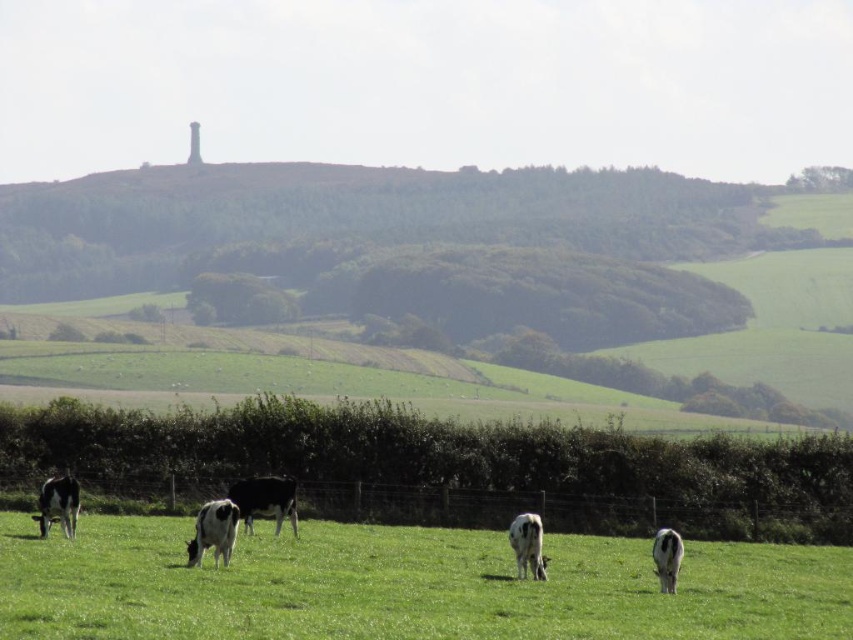
Who is taller, black and white spotted cow at lower left or white glossy cow at center?

black and white spotted cow at lower left

At what (x,y) coordinates should I click in order to perform the action: click on black and white spotted cow at lower left. Please return your answer as a coordinate pair (x, y). The height and width of the screenshot is (640, 853). Looking at the image, I should click on (213, 531).

The width and height of the screenshot is (853, 640). Identify the location of black and white spotted cow at lower left. (213, 531).

Who is higher up, green grassy field at lower center or metal wire fence at lower center?

green grassy field at lower center is above.

Image resolution: width=853 pixels, height=640 pixels. What do you see at coordinates (404, 586) in the screenshot?
I see `green grassy field at lower center` at bounding box center [404, 586].

Is point (408, 628) closer to camera compared to point (183, 496)?

Yes, point (408, 628) is in front of point (183, 496).

This screenshot has height=640, width=853. What are the coordinates of `green grassy field at lower center` in the screenshot? It's located at (404, 586).

Can you confirm if green grassy field at lower center is positioned to the right of white glossy cow at lower right?

No, green grassy field at lower center is not to the right of white glossy cow at lower right.

Does green grassy field at lower center appear over white glossy cow at lower right?

No.

Between point (561, 628) and point (668, 563), which one is positioned in front?

Point (561, 628) is more forward.

I want to click on green grassy field at lower center, so click(x=404, y=586).